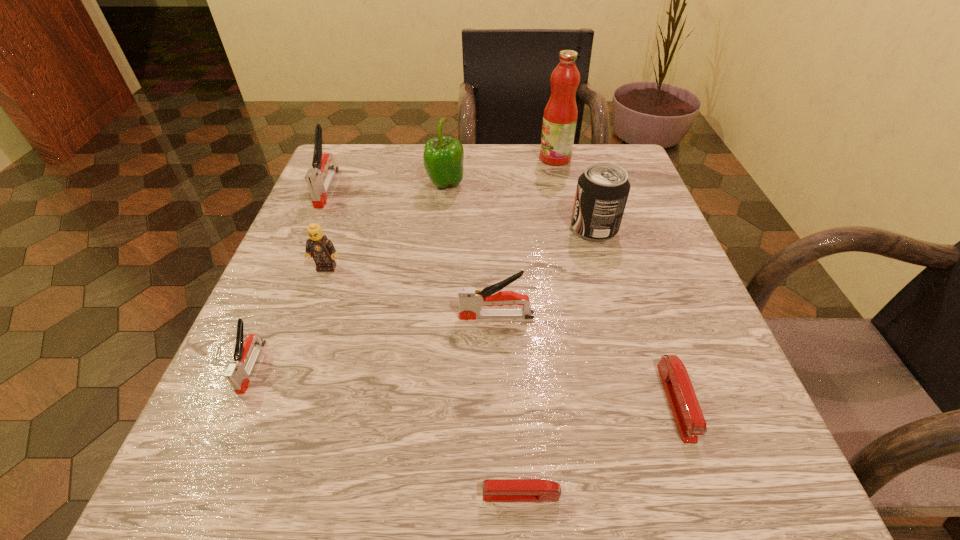
The image size is (960, 540). Find the location of `vacant space in between the second tallest stapler and the bigger red stapler`. vacant space in between the second tallest stapler and the bigger red stapler is located at coordinates (587, 359).

Locate an element on the screen. The height and width of the screenshot is (540, 960). vacant space that is in between the Lego and the fourth nearest stapler is located at coordinates (412, 292).

Where is `vacant space that is in between the smaller red stapler and the bell pepper`? vacant space that is in between the smaller red stapler and the bell pepper is located at coordinates point(483,340).

Locate an element on the screen. free area in between the fourth nearest stapler and the nearest object is located at coordinates (509, 406).

This screenshot has height=540, width=960. Identify the location of vacant area that lies between the second farthest gray stapler and the soda can. (545, 272).

Find the location of a particular element. This screenshot has height=540, width=960. vacant point located between the second farthest gray stapler and the bigger red stapler is located at coordinates (587, 359).

Locate an element on the screen. free space between the rightmost gray stapler and the pink fruit juice is located at coordinates (526, 237).

Locate an element on the screen. empty location between the farther red stapler and the second smallest gray stapler is located at coordinates (587, 359).

Find the location of a particular element. free space between the sixth nearest object and the second smallest gray stapler is located at coordinates (545, 272).

Locate which object is the closest to the soda can. Please provide its 2D coordinates. Your answer should be formatted as a tuple, i.e. [(x, y)], where the tuple contains the x and y coordinates of a point satisfying the conditions above.

[(560, 115)]